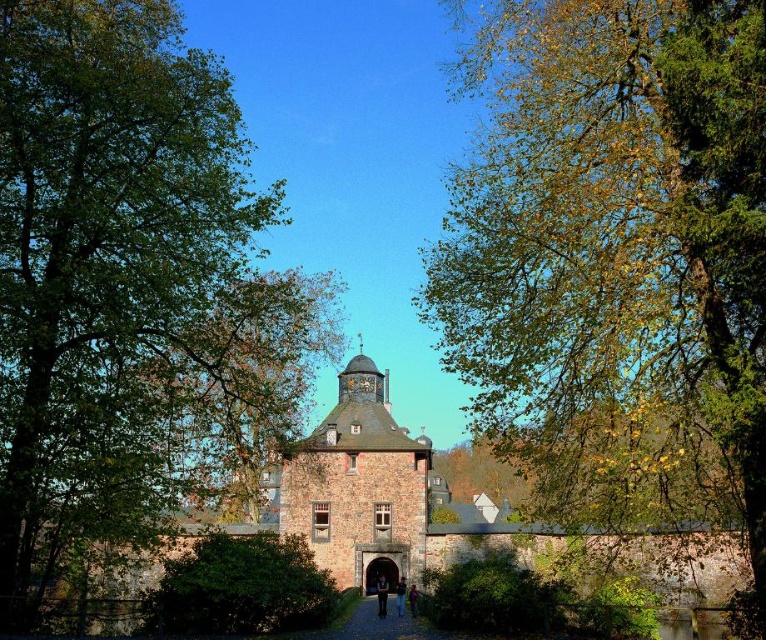
You are standing at the entrance of the castle and want to walk towards the green leafy bush at center. Which direction should you move relative to the brown stone path at center?

A: The green leafy bush at center is located above the brown stone path at center, so you should move forward along the brown stone path at center towards the castle to reach the green leafy bush at center.

You are standing at the entrance of the castle and see two points marked in the image. The first point is at coordinates point (681, 234) and the second point is at point (332, 634). Which of these two points is closer to you?

Point (681, 234) is in front of point (332, 634), so it is closer to you.